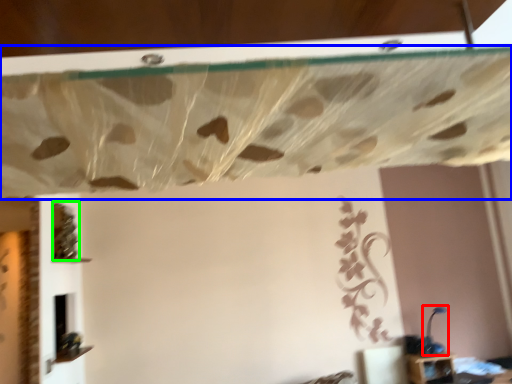
Question: Which object is the farthest from lamp (highlighted by a red box)? Choose among these: curtain (highlighted by a blue box) or vine (highlighted by a green box).

Choices:
 (A) curtain
 (B) vine

Answer: (A)